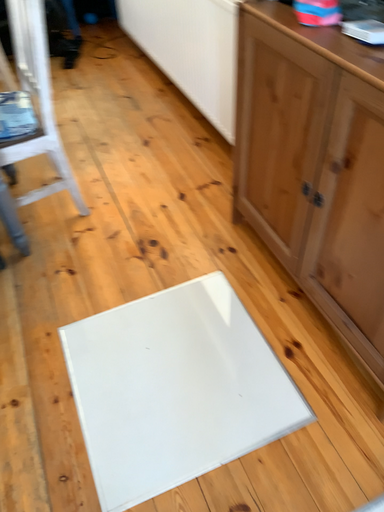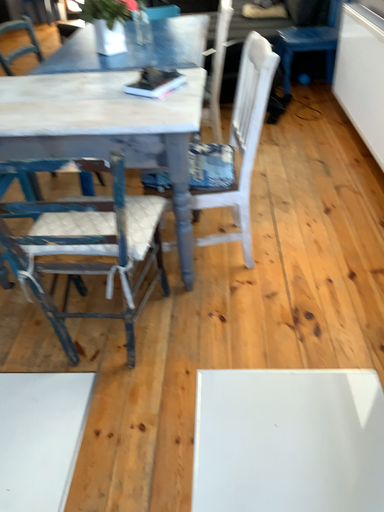
Question: Which way did the camera rotate in the video?

Choices:
 (A) rotated right
 (B) rotated left

Answer: (B)